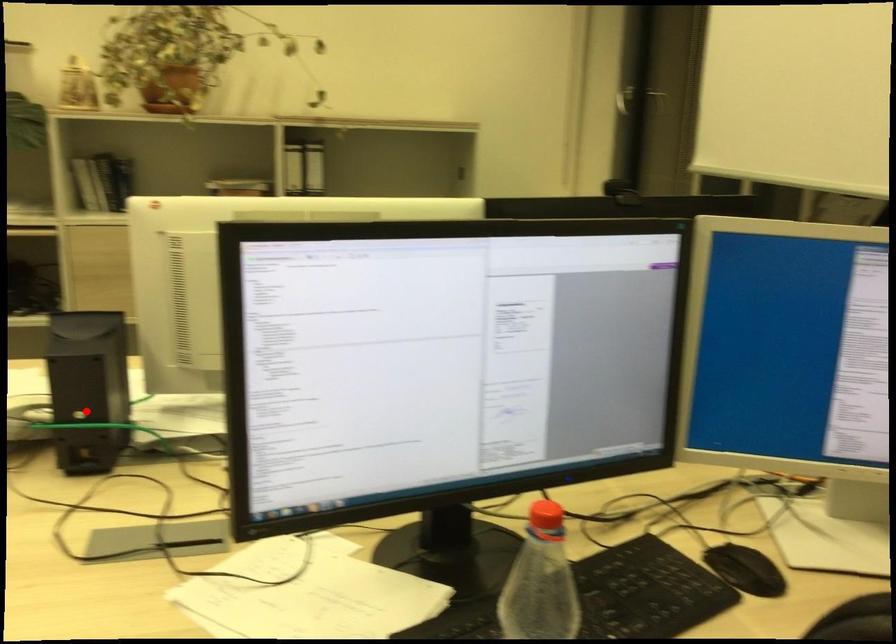
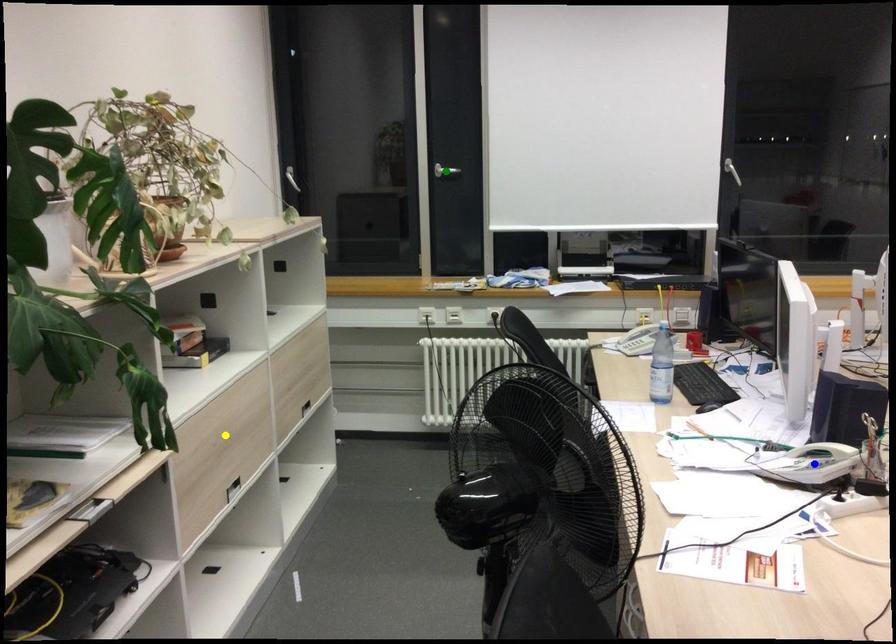
Question: I am providing you with two images of the same scene from different viewpoints. A red point is marked on the first image. You are given multiple points on the second image. Which spot in image 2 lines up with the point in image 1?

Choices:
 (A) yellow point
 (B) blue point
 (C) green point

Answer: (B)